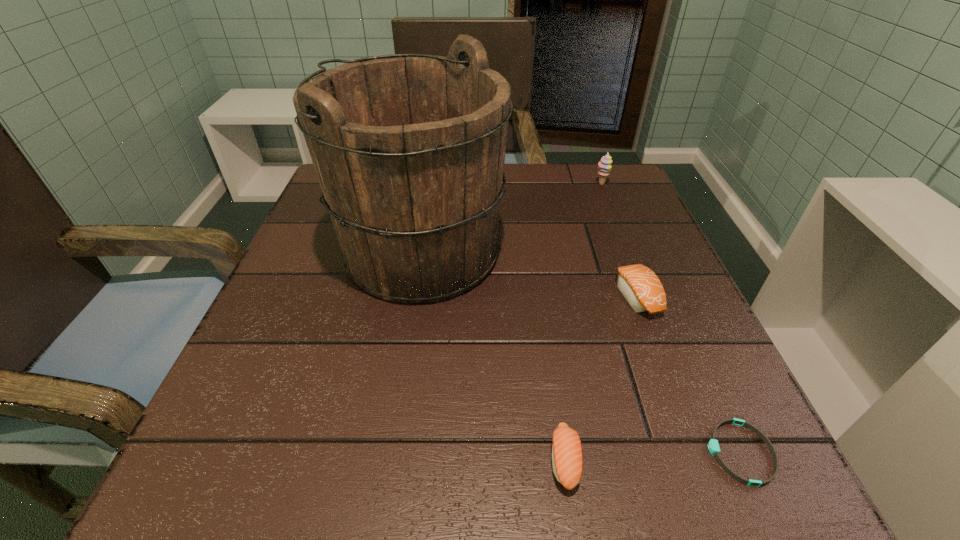
Locate an element on the screen. sherbert situated at the right edge is located at coordinates (604, 165).

Locate an element on the screen. The width and height of the screenshot is (960, 540). sushi located at the right edge is located at coordinates (642, 289).

Identify the location of wristband at the right edge. (713, 445).

This screenshot has height=540, width=960. I want to click on object that is at the far left corner, so click(409, 149).

Identify the location of object that is at the far right corner. This screenshot has height=540, width=960. (604, 165).

Identify the location of object at the near right corner. The width and height of the screenshot is (960, 540). (713, 445).

You are a GUI agent. You are given a task and a screenshot of the screen. Output one action in this format:
    pyautogui.click(x=<x>, y=<y>)
    Task: Click on the vacant space at the near edge
    
    Given the screenshot: What is the action you would take?
    pyautogui.click(x=509, y=494)

Find the location of a particular element. This screenshot has height=540, width=960. vacant space at the left edge of the desktop is located at coordinates (323, 346).

In the image, there is a desktop. Where is `free space at the right edge`? The image size is (960, 540). free space at the right edge is located at coordinates (722, 433).

Identify the location of vacant space at the near right corner. (691, 468).